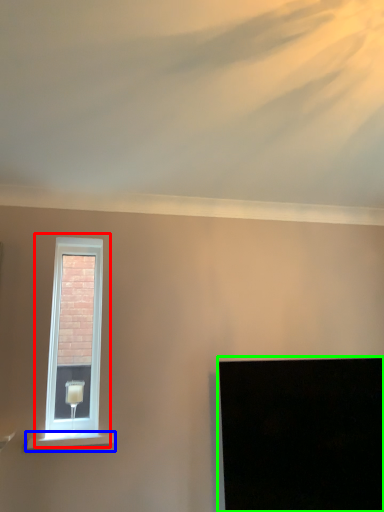
Question: Based on their relative distances, which object is nearer to window (highlighted by a red box)? Choose from window sill (highlighted by a blue box) and computer screen (highlighted by a green box).

Choices:
 (A) window sill
 (B) computer screen

Answer: (A)